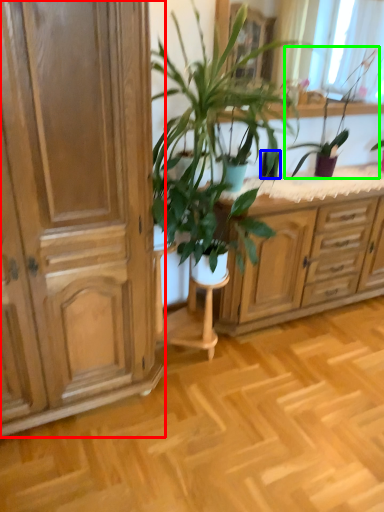
Question: Which is farther away from cabinetry (highlighted by a red box)? flowerpot (highlighted by a blue box) or houseplant (highlighted by a green box)?

Choices:
 (A) flowerpot
 (B) houseplant

Answer: (B)